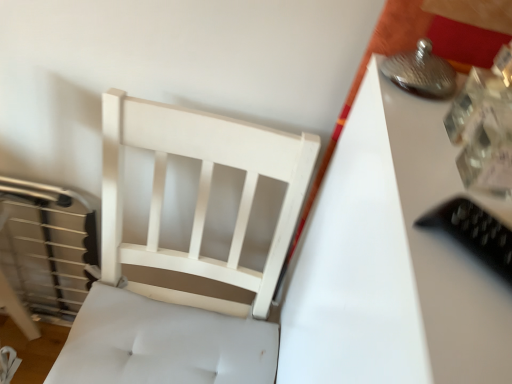
Question: Is white glossy table at upper right to the left of black plastic remote at right from the viewer's perspective?

Choices:
 (A) yes
 (B) no

Answer: (B)

Question: Is white glossy table at upper right thinner than black plastic remote at right?

Choices:
 (A) yes
 (B) no

Answer: (B)

Question: Is white glossy table at upper right facing towards black plastic remote at right?

Choices:
 (A) no
 (B) yes

Answer: (A)

Question: Is white glossy table at upper right bigger than black plastic remote at right?

Choices:
 (A) no
 (B) yes

Answer: (B)

Question: Can we say white glossy table at upper right lies outside black plastic remote at right?

Choices:
 (A) no
 (B) yes

Answer: (B)

Question: Considering the relative sizes of white glossy table at upper right and black plastic remote at right in the image provided, is white glossy table at upper right wider than black plastic remote at right?

Choices:
 (A) no
 (B) yes

Answer: (B)

Question: Does black plastic remote at right appear on the left side of white wood chair at left?

Choices:
 (A) yes
 (B) no

Answer: (B)

Question: Is black plastic remote at right touching white wood chair at left?

Choices:
 (A) no
 (B) yes

Answer: (A)

Question: Is black plastic remote at right located outside white wood chair at left?

Choices:
 (A) no
 (B) yes

Answer: (B)

Question: Does black plastic remote at right turn towards white wood chair at left?

Choices:
 (A) yes
 (B) no

Answer: (B)

Question: Does black plastic remote at right have a lesser width compared to white wood chair at left?

Choices:
 (A) yes
 (B) no

Answer: (A)

Question: From the image's perspective, is black plastic remote at right under white wood chair at left?

Choices:
 (A) no
 (B) yes

Answer: (A)

Question: Can you confirm if white wood chair at left is bigger than black plastic remote at right?

Choices:
 (A) yes
 (B) no

Answer: (A)